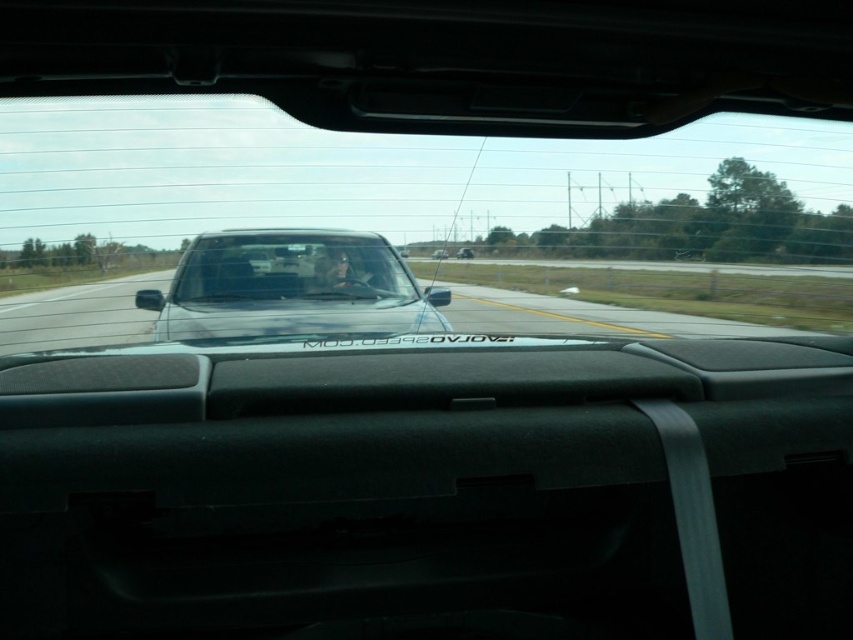
You are driving a car and want to know if you can see the entire black glossy car at center through the transparent glass car window at center. Can you see the entire car?

The transparent glass car window at center is taller than black glossy car at center, so yes, you can see the entire black glossy car at center through the transparent glass car window at center because the window is taller than the car.

You are driving a car and see two points on the road ahead. One is at point coordinates point [724,164] and the other at point [184,298]. Which point is closer to your car?

Point [724,164] is further to the viewer than point [184,298], so the point closer to your car is point [184,298].

You are driving a car and want to check the weather outside. You notice two glass components in front of you. Which one is wider between the transparent glass car window at center and the clear glass windshield at center?

The transparent glass car window at center is wider than the clear glass windshield at center according to the description.